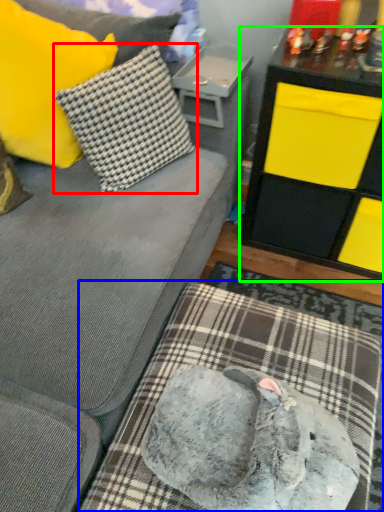
Question: Which object is the farthest from pillow (highlighted by a red box)? Choose among these: dog bed (highlighted by a blue box) or table (highlighted by a green box).

Choices:
 (A) dog bed
 (B) table

Answer: (A)